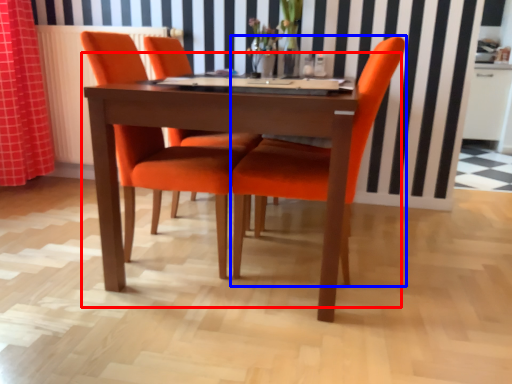
Question: Which object is closer to the camera taking this photo, kitchen & dining room table (highlighted by a red box) or chair (highlighted by a blue box)?

Choices:
 (A) kitchen & dining room table
 (B) chair

Answer: (A)